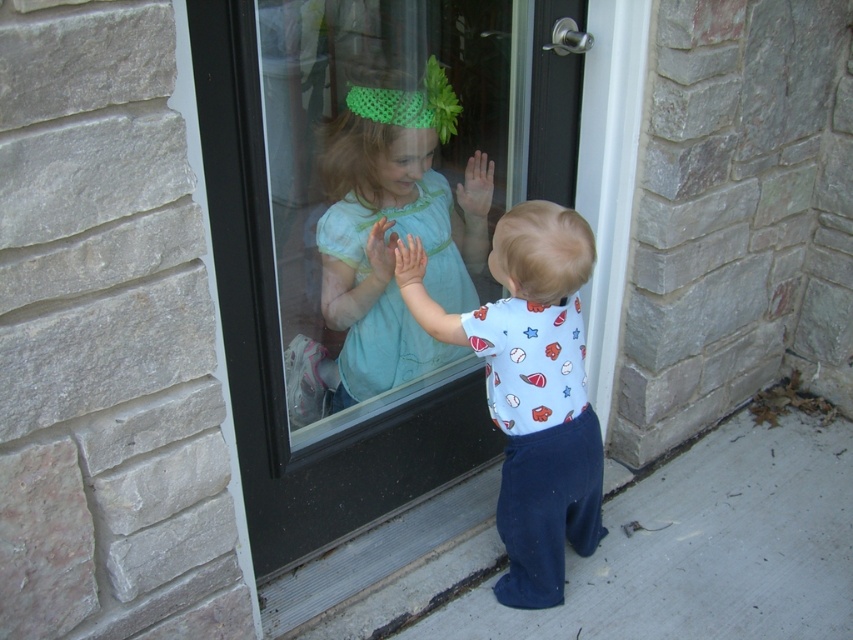
Who is shorter, clear glass door at center or light blue cotton onesie at center?

light blue cotton onesie at center

Between point (405, 209) and point (573, 456), which one is positioned behind?

Positioned behind is point (405, 209).

Who is more distant from viewer, (196, 38) or (567, 346)?

The point (567, 346) is more distant.

Find the location of a particular element. clear glass door at center is located at coordinates (367, 259).

Is clear glass door at center thinner than light blue fabric dress at center?

No, clear glass door at center is not thinner than light blue fabric dress at center.

Which of these two, clear glass door at center or light blue fabric dress at center, stands taller?

clear glass door at center is taller.

I want to click on clear glass door at center, so click(x=367, y=259).

Identify the location of clear glass door at center. (367, 259).

Between light blue cotton onesie at center and light blue fabric dress at center, which one is positioned higher?

light blue fabric dress at center

This screenshot has height=640, width=853. In order to click on light blue cotton onesie at center in this screenshot , I will do `click(531, 390)`.

Identify the location of light blue cotton onesie at center. (531, 390).